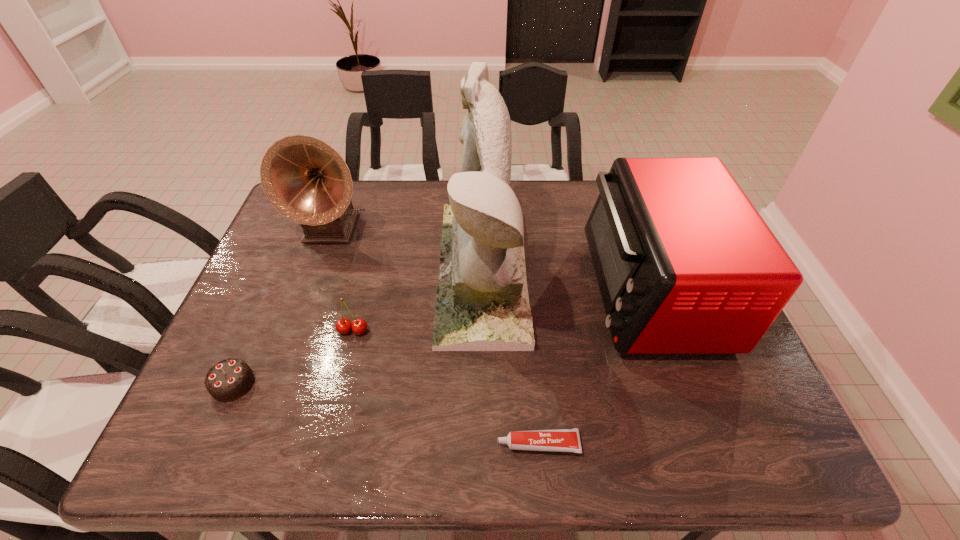
You are a GUI agent. You are given a task and a screenshot of the screen. Output one action in this format:
    pyautogui.click(x=<x>, y=<y>)
    Task: Click on the vacant space located 0.250m at the nozzle of the nearest object
    This screenshot has width=960, height=540.
    Given the screenshot: What is the action you would take?
    372,444

You are a GUI agent. You are given a task and a screenshot of the screen. Output one action in this format:
    pyautogui.click(x=<x>, y=<y>)
    Task: Click on the sculpture present at the far edge
    This screenshot has width=960, height=540.
    Given the screenshot: What is the action you would take?
    482,304

You are a GUI agent. You are given a task and a screenshot of the screen. Output one action in this format:
    pyautogui.click(x=<x>, y=<y>)
    Task: Click on the phonograph record that is at the far edge
    
    Given the screenshot: What is the action you would take?
    pyautogui.click(x=306, y=180)

You are a GUI agent. You are given a task and a screenshot of the screen. Output one action in this format:
    pyautogui.click(x=<x>, y=<y>)
    Task: Click on the object located at the near edge
    
    Given the screenshot: What is the action you would take?
    pyautogui.click(x=560, y=440)

At what (x,y) coordinates should I click in order to perform the action: click on phonograph record that is positioned at the left edge. Please return your answer as a coordinate pair (x, y). Looking at the image, I should click on (306, 180).

The width and height of the screenshot is (960, 540). What are the coordinates of `chocolate cake located at the left edge` in the screenshot? It's located at pyautogui.click(x=229, y=379).

At what (x,y) coordinates should I click in order to perform the action: click on object at the right edge. Please return your answer as a coordinate pair (x, y). This screenshot has width=960, height=540. Looking at the image, I should click on (685, 264).

The image size is (960, 540). In order to click on object that is at the far left corner in this screenshot , I will do `click(306, 180)`.

Find the location of a particular element. This screenshot has height=540, width=960. vacant space at the far edge is located at coordinates pyautogui.click(x=591, y=205).

Identify the location of vacant space at the far left corner of the desktop. click(285, 219).